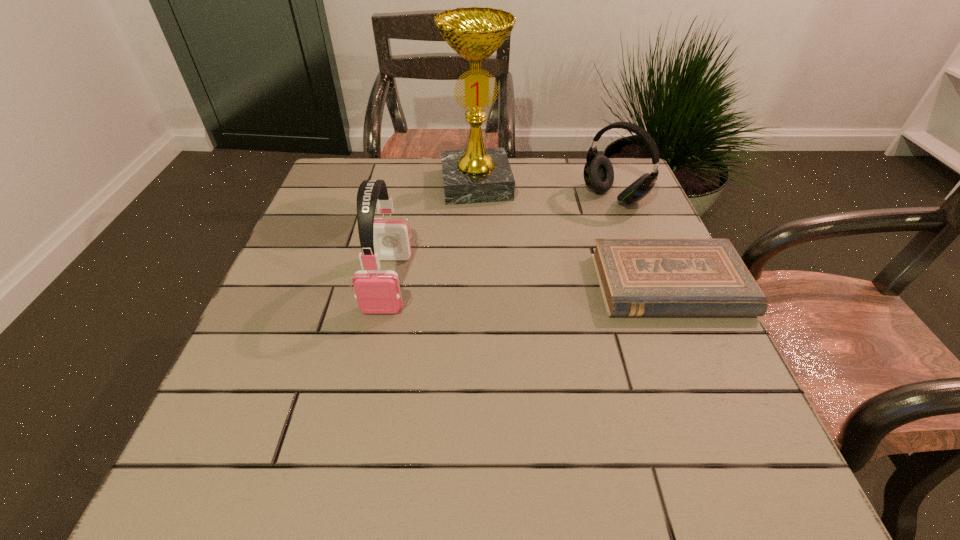
Locate an element on the screen. The image size is (960, 540). vacant area situated 0.280m on the front-facing side of the second object from left to right is located at coordinates (494, 278).

Locate an element on the screen. free location located 0.200m on the ear cups of the second shortest object is located at coordinates (548, 245).

You are a GUI agent. You are given a task and a screenshot of the screen. Output one action in this format:
    pyautogui.click(x=<x>, y=<y>)
    Task: Click on the vacant area situated 0.130m on the ear cups of the second shortest object
    Image resolution: width=960 pixels, height=540 pixels.
    Given the screenshot: What is the action you would take?
    pyautogui.click(x=566, y=232)

At what (x,y) coordinates should I click in order to perform the action: click on free point located on the ear cups of the second shortest object. Please return your answer as a coordinate pair (x, y). Looking at the image, I should click on (503, 279).

At what (x,y) coordinates should I click in order to perform the action: click on award present at the far edge. Please return your answer as a coordinate pair (x, y). This screenshot has width=960, height=540. Looking at the image, I should click on (477, 174).

The width and height of the screenshot is (960, 540). What are the coordinates of `headset that is at the far edge` in the screenshot? It's located at (598, 173).

Image resolution: width=960 pixels, height=540 pixels. What are the coordinates of `Bible that is at the right edge` in the screenshot? It's located at (x=638, y=277).

You are a GUI agent. You are given a task and a screenshot of the screen. Output one action in this format:
    pyautogui.click(x=<x>, y=<y>)
    Task: Click on the headset present at the right edge
    
    Given the screenshot: What is the action you would take?
    pyautogui.click(x=598, y=173)

What are the coordinates of `object that is at the far right corner` in the screenshot? It's located at (598, 173).

Identify the location of vacant region at the far edge of the desktop. (431, 180).